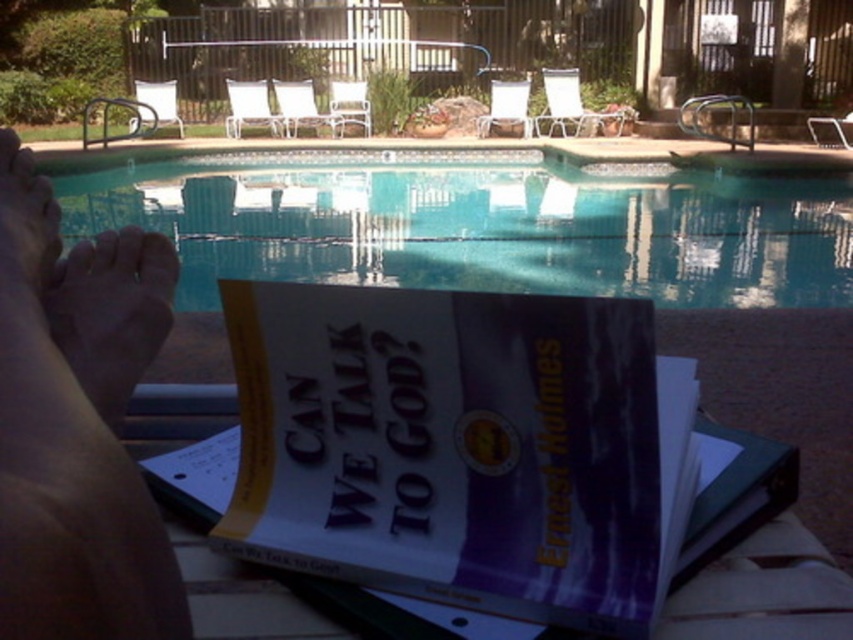
Can you confirm if purple paper book at center is thinner than clear glass water at center?

No.

Does purple paper book at center come in front of clear glass water at center?

Yes, purple paper book at center is in front of clear glass water at center.

Between point (561, 620) and point (798, 262), which one is positioned behind?

The point (798, 262) is behind.

In order to click on purple paper book at center in this screenshot , I will do `click(451, 445)`.

Can you confirm if brown skin at lower left is shorter than pale skin at lower left?

Indeed, brown skin at lower left has a lesser height compared to pale skin at lower left.

Who is lower down, brown skin at lower left or pale skin at lower left?

brown skin at lower left is lower down.

Does point (93, 268) lie in front of point (59, 252)?

That is True.

Find the location of `brown skin at lower left`. brown skin at lower left is located at coordinates (111, 312).

Does point (506, 536) come in front of point (149, 525)?

No, (506, 536) is behind (149, 525).

Can you confirm if purple paper book at center is bigger than skinny bare feet at lower left?

Incorrect, purple paper book at center is not larger than skinny bare feet at lower left.

Find the location of `purple paper book at center`. purple paper book at center is located at coordinates (451, 445).

You are a GUI agent. You are given a task and a screenshot of the screen. Output one action in this format:
    pyautogui.click(x=<x>, y=<y>)
    Task: Click on the purple paper book at center
    The height and width of the screenshot is (640, 853).
    Given the screenshot: What is the action you would take?
    pyautogui.click(x=451, y=445)